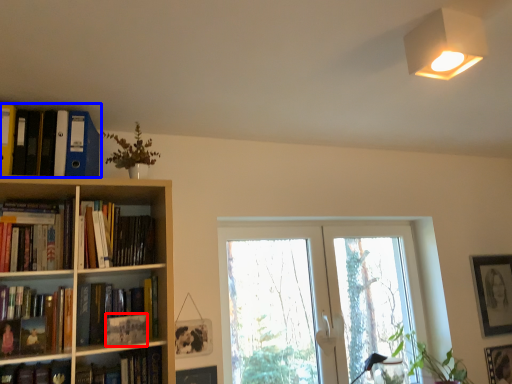
Question: Which of the following is the closest to the observer, paperback book (highlighted by a red box) or book (highlighted by a blue box)?

Choices:
 (A) paperback book
 (B) book

Answer: (B)